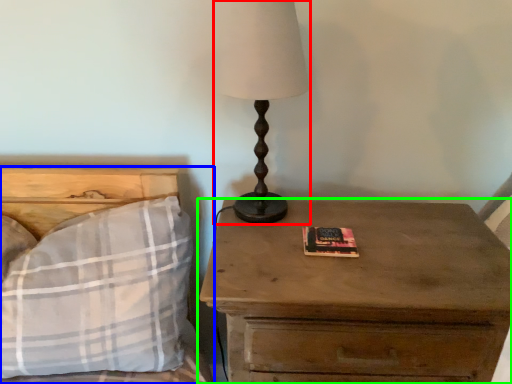
Question: Which object is the farthest from table lamp (highlighted by a red box)? Choose among these: bed (highlighted by a blue box) or nightstand (highlighted by a green box).

Choices:
 (A) bed
 (B) nightstand

Answer: (A)